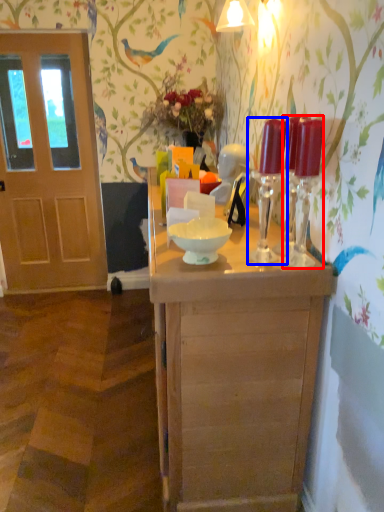
Question: Which point is closer to the camera, candle holder (highlighted by a red box) or candle holder (highlighted by a blue box)?

Choices:
 (A) candle holder
 (B) candle holder

Answer: (A)